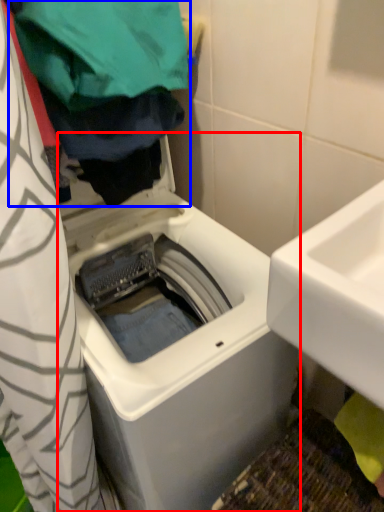
Question: Which point is further to the camera, washing machine (highlighted by a red box) or clothing (highlighted by a blue box)?

Choices:
 (A) washing machine
 (B) clothing

Answer: (A)